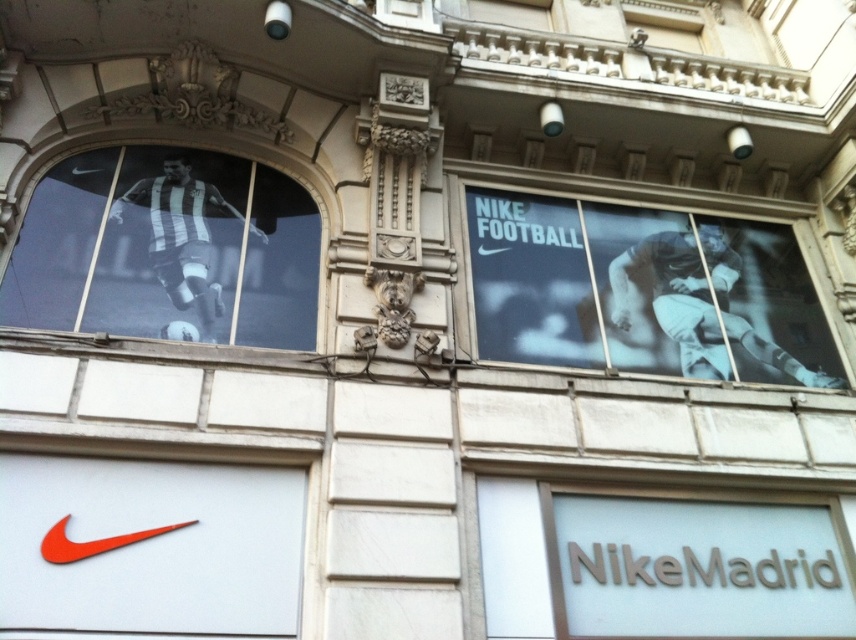
Question: Is blue fabric poster at right further to the viewer compared to black and white striped jersey at upper left?

Choices:
 (A) yes
 (B) no

Answer: (A)

Question: Does blue fabric poster at right have a greater width compared to black and white striped jersey at upper left?

Choices:
 (A) yes
 (B) no

Answer: (A)

Question: Can you confirm if blue fabric poster at right is smaller than black and white striped jersey at upper left?

Choices:
 (A) no
 (B) yes

Answer: (A)

Question: Which of the following is the farthest from the observer?

Choices:
 (A) (620, 349)
 (B) (194, 250)

Answer: (A)